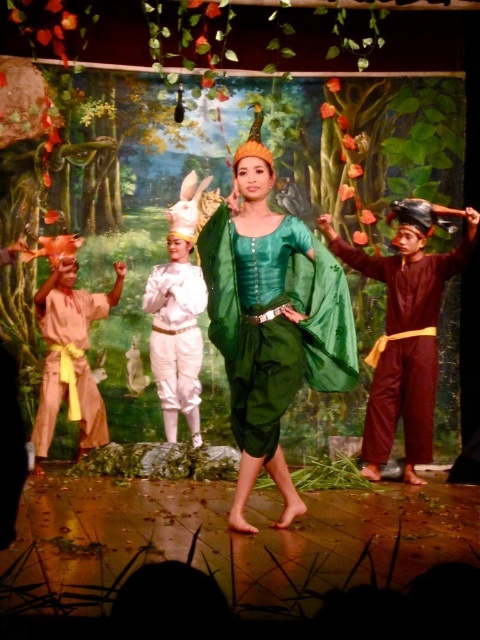
Based on the scene description, can you determine the spatial relationship between the green silk dress at center and the matte brown robe at left? Specifically, which object is positioned higher in the image?

The green silk dress at center is located above the matte brown robe at left, meaning it is positioned higher in the image.

You are a stagehand preparing to adjust the lighting for the performance. You need to position a spotlight so that it can illuminate both the brown matte pants at right and the white satin pants at center simultaneously. Given that the spotlight has a maximum effective range of 2 meters, will you be able to cover both objects with a single spotlight?

The brown matte pants at right is 1.92 meters away from the white satin pants at center. Since the distance between them is within the spotlight maximum effective range of 2 meters, you can position the spotlight to cover both objects with a single spotlight.

In the theatrical performance scene, there are two performers wearing brown matte pants at right and white satin pants at center. Which performer is located to the right of the other?

The brown matte pants at right is positioned on the right side of white satin pants at center.